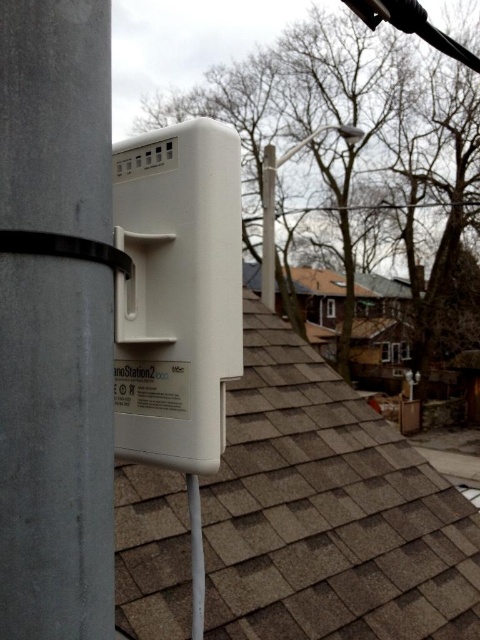
You are a technician needing to install a new cable between the brown shingles at center and the white plastic lamp post at upper center. The cable you have is 7 meters long. Will it be sufficient to connect them without needing to stretch it?

The distance between the brown shingles at center and the white plastic lamp post at upper center is 7.40 meters. Since the cable is only 7 meters long, it is 0.40 meters shorter than required. Therefore, the cable will not be sufficient and stretching may be necessary to make the connection.

You are standing in front of the nanoStation2 device mounted on the gray utility pole. You need to locate the brown shingles at center. Where exactly are they positioned relative to the device?

The brown shingles at center are positioned at point coordinates of 0.800 in the x axis and 0.683 in the y axis relative to the nanoStation2 device.